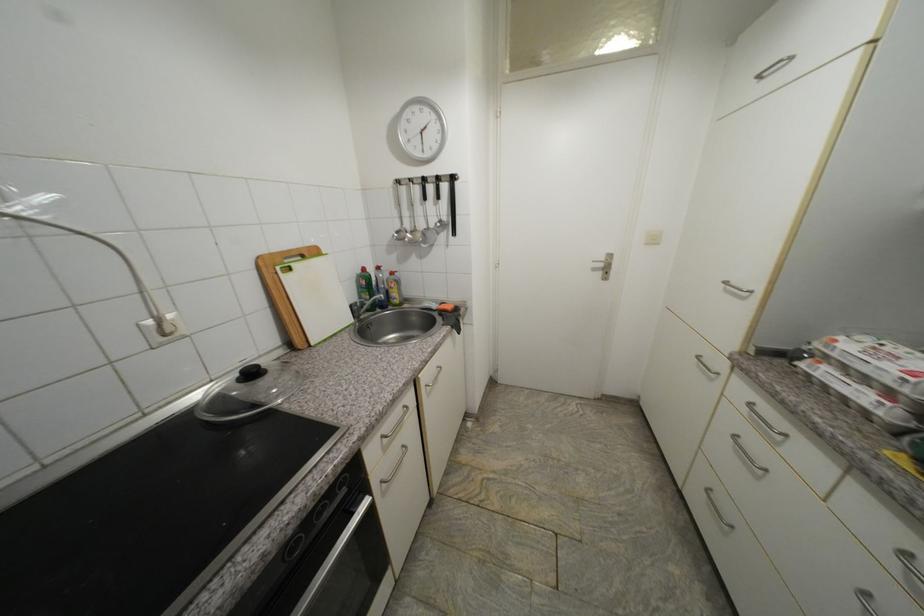
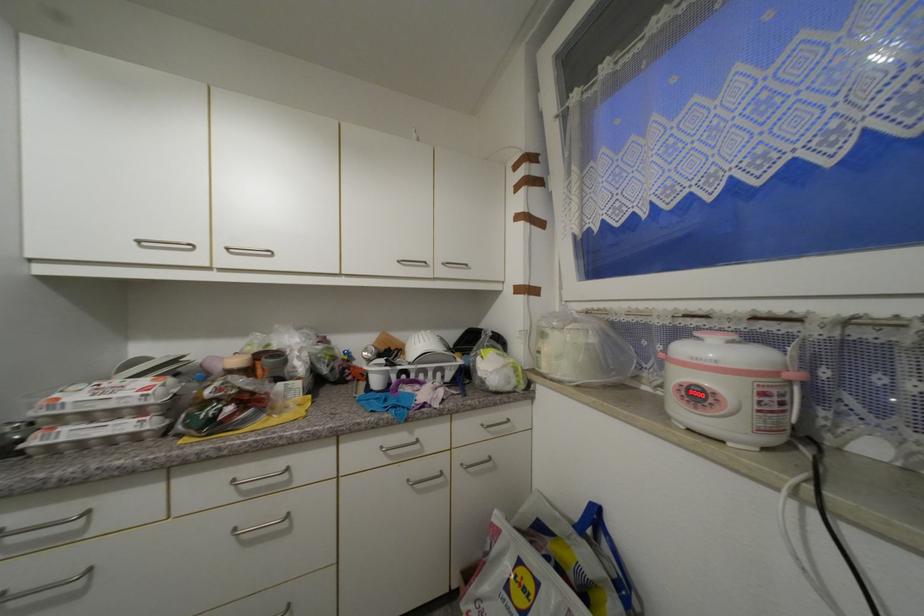
Find the pixel in the second image that matches (x=743, y=438) in the first image.

(6, 597)